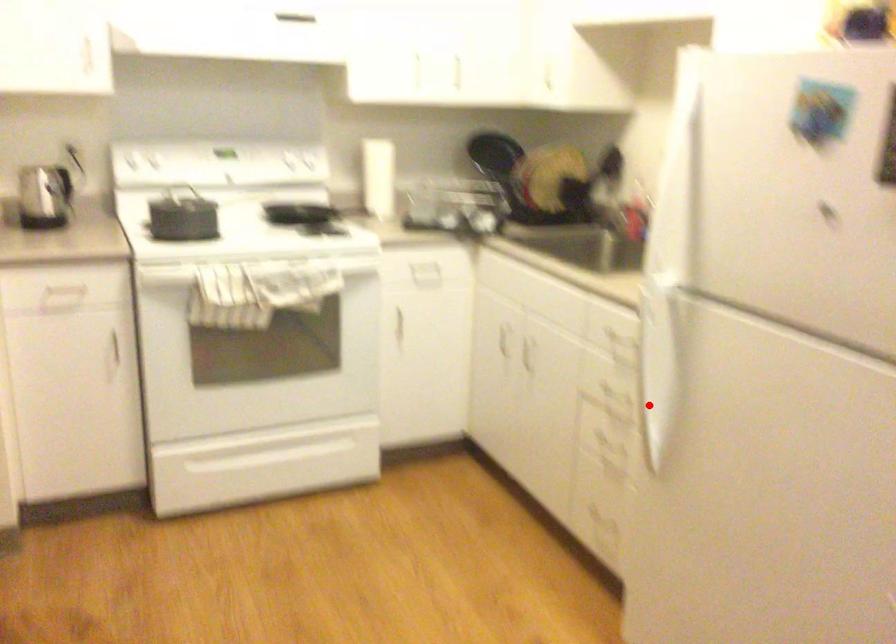
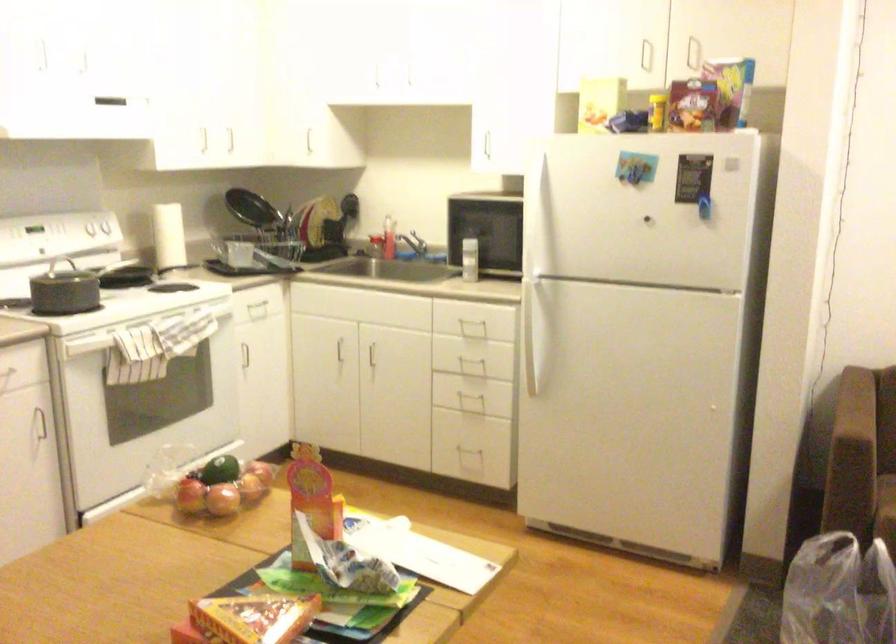
Question: I am providing you with two images of the same scene from different viewpoints. In image1, a red point is highlighted. Considering the same 3D point in image2, which of the following is correct?

Choices:
 (A) It is closer
 (B) It is farther

Answer: (B)